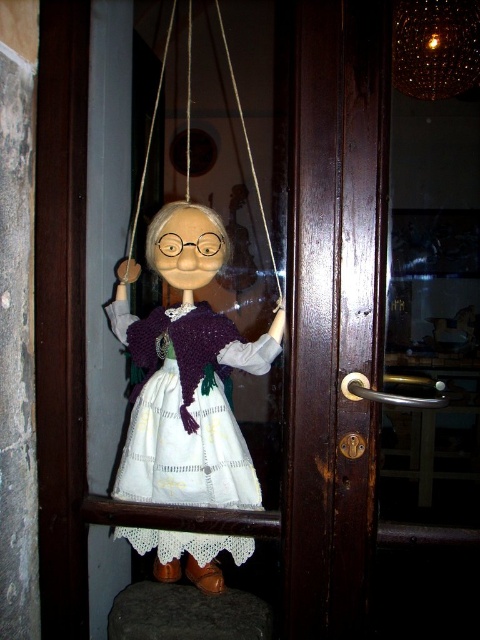
Question: Does white lace dress at center have a greater width compared to white string at upper center?

Choices:
 (A) no
 (B) yes

Answer: (B)

Question: Considering the relative positions of white lace dress at center and silky brown string at upper center in the image provided, where is white lace dress at center located with respect to silky brown string at upper center?

Choices:
 (A) left
 (B) right

Answer: (B)

Question: Which of the following is the closest to the observer?

Choices:
 (A) (156, 102)
 (B) (245, 140)

Answer: (A)

Question: Among these objects, which one is farthest from the camera?

Choices:
 (A) silky brown string at upper center
 (B) white lace dress at center
 (C) white string at upper center

Answer: (A)

Question: Among these points, which one is nearest to the camera?

Choices:
 (A) (126, 273)
 (B) (219, 29)

Answer: (A)

Question: Is white string at upper center to the left of silky brown string at upper center from the viewer's perspective?

Choices:
 (A) yes
 (B) no

Answer: (B)